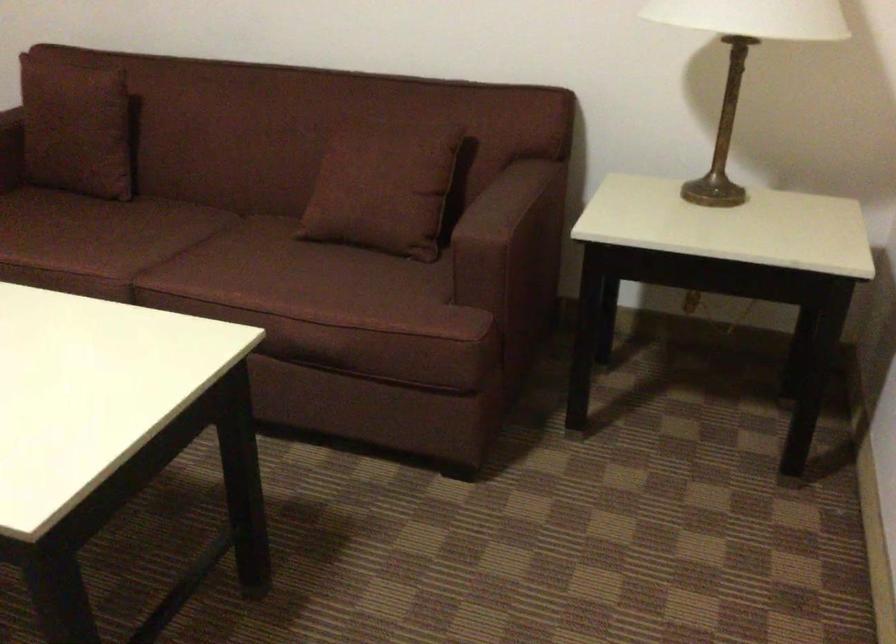
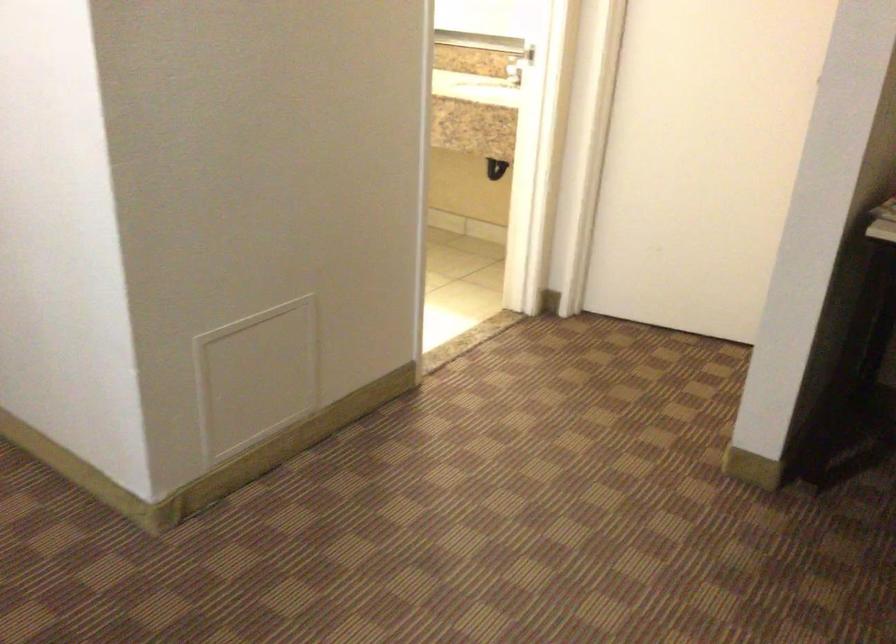
Based on the photo, the images are taken continuously from a first-person perspective. In which direction is your viewpoint rotating?

The camera's rotation is toward right-down.